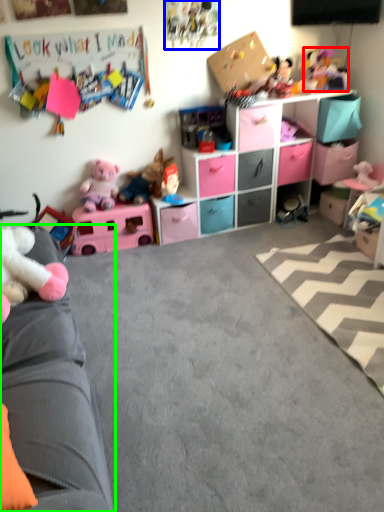
Question: Which is nearer to the toy (highlighted by a red box)? toy (highlighted by a blue box) or studio couch (highlighted by a green box).

Choices:
 (A) toy
 (B) studio couch

Answer: (A)